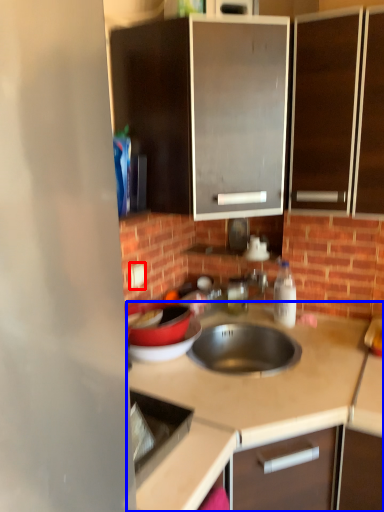
Question: Which point is further to the camera, electric outlet (highlighted by a red box) or countertop (highlighted by a blue box)?

Choices:
 (A) electric outlet
 (B) countertop

Answer: (A)